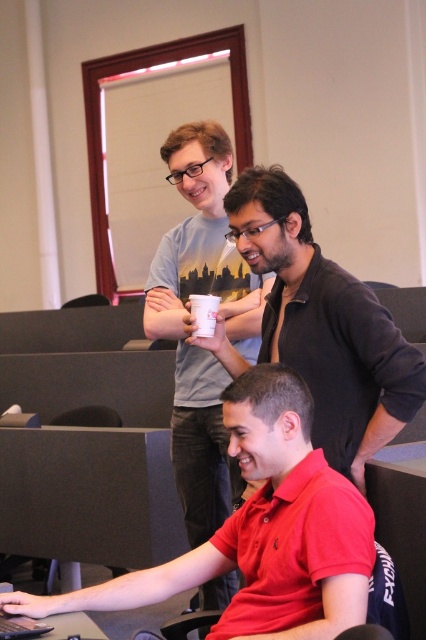
Question: Does red matte shirt at center have a larger size compared to black matte laptop at lower left?

Choices:
 (A) no
 (B) yes

Answer: (B)

Question: Which is nearer to the red matte shirt at center?

Choices:
 (A) matte black shirt at upper center
 (B) white paper cup at upper center
 (C) light gray t-shirt at center

Answer: (A)

Question: Which is farther from the matte black shirt at upper center?

Choices:
 (A) light gray t-shirt at center
 (B) red matte shirt at center
 (C) black matte laptop at lower left
 (D) white paper cup at upper center

Answer: (C)

Question: Which object is the closest to the white paper cup at upper center?

Choices:
 (A) matte black shirt at upper center
 (B) black matte laptop at lower left
 (C) light gray t-shirt at center
 (D) red matte shirt at center

Answer: (A)

Question: Is matte black shirt at upper center bigger than light gray t-shirt at center?

Choices:
 (A) yes
 (B) no

Answer: (B)

Question: Is red matte shirt at center further to camera compared to white paper cup at upper center?

Choices:
 (A) no
 (B) yes

Answer: (A)